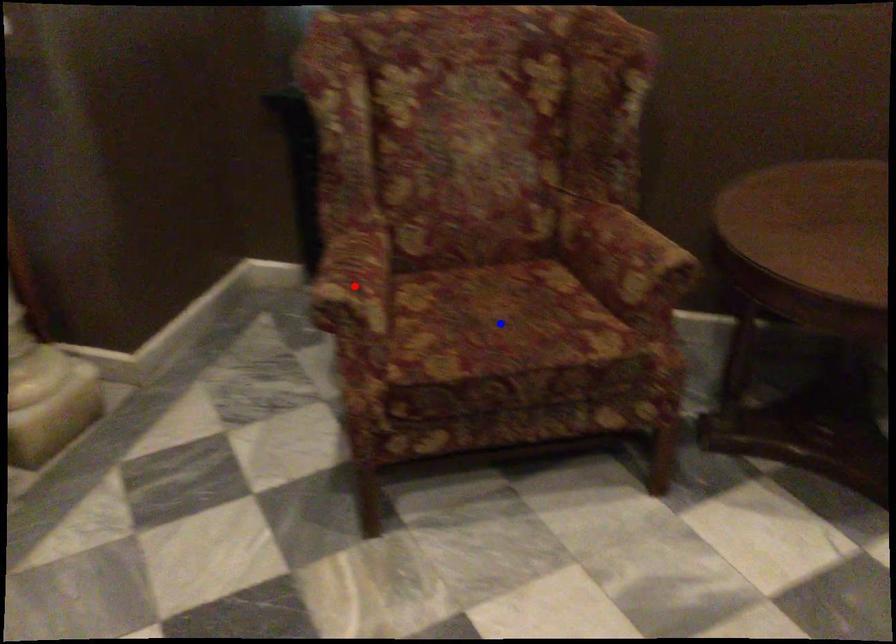
Question: In the image, two points are highlighted. Which point is nearer to the camera? Reply with the corresponding letter.

Choices:
 (A) blue point
 (B) red point

Answer: (B)